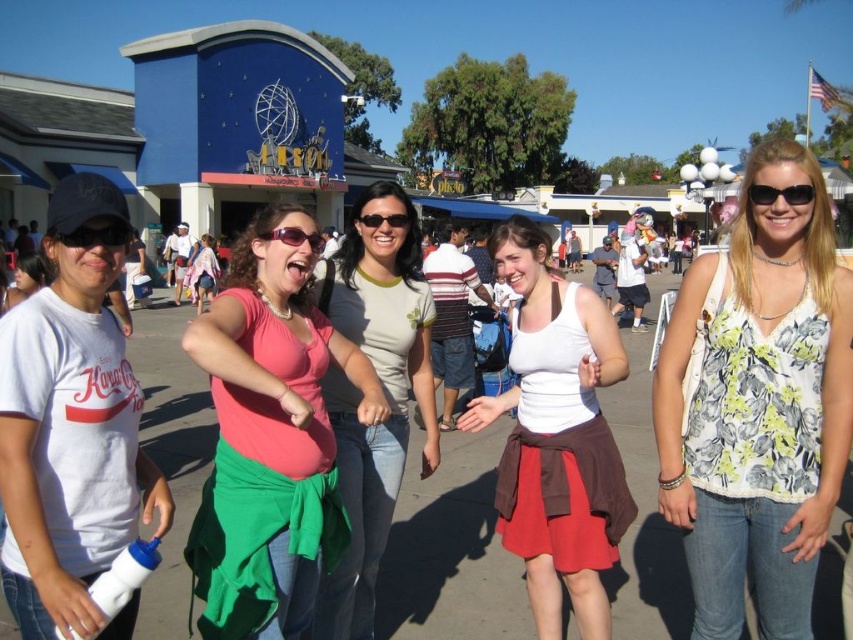
Question: Which point appears farthest from the camera in this image?

Choices:
 (A) coord(757,193)
 (B) coord(366,221)

Answer: (B)

Question: In this image, where is white cotton tank top at center located relative to pink fabric shirt at center?

Choices:
 (A) right
 (B) left

Answer: (A)

Question: Among these objects, which one is farthest from the camera?

Choices:
 (A) sunglasses at upper right
 (B) pink fabric skirt at center

Answer: (A)

Question: Is pink fabric shirt at center closer to camera compared to matte pink sunglasses at center?

Choices:
 (A) no
 (B) yes

Answer: (B)

Question: Can you confirm if white matte t-shirt at left is positioned below white cotton tank top at center?

Choices:
 (A) no
 (B) yes

Answer: (A)

Question: Estimate the real-world distances between objects in this image. Which object is farther from the sunglasses at upper right?

Choices:
 (A) pink fabric skirt at center
 (B) pink fabric shirt at center

Answer: (A)